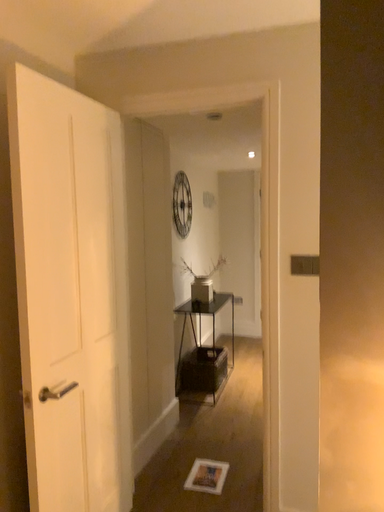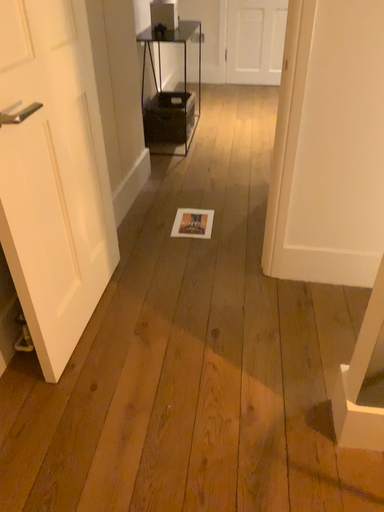
Question: How did the camera likely rotate when shooting the video?

Choices:
 (A) rotated downward
 (B) rotated upward

Answer: (A)